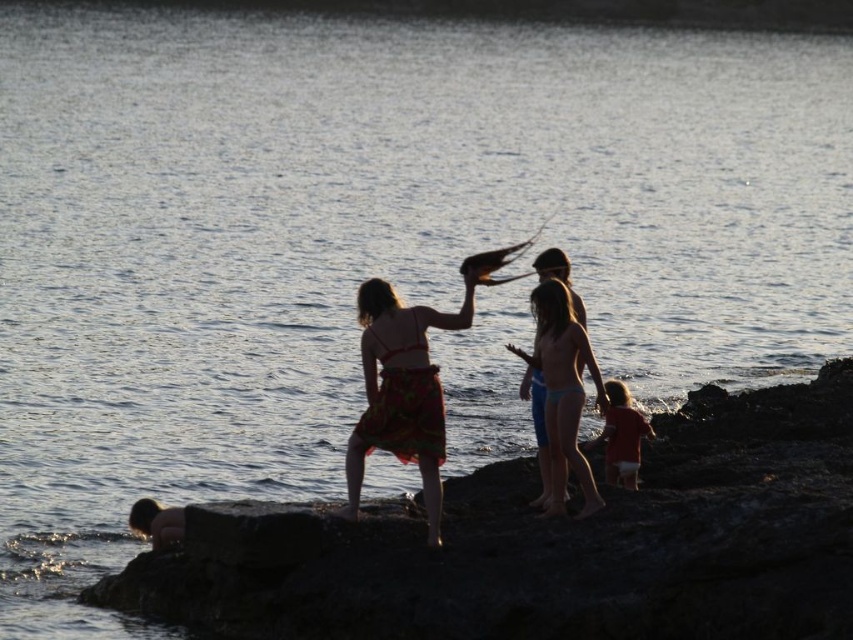
From the picture: You are a photographer trying to capture a wide shot of the lakeside scene. You notice the silhouette floral skirt at center and the red matte shirt at lower right in your frame. Based on their widths, which object should you prioritize keeping in focus to ensure the entire scene remains sharp?

The silhouette floral skirt at center has a lesser width compared to red matte shirt at lower right. Since the silhouette floral skirt at center is narrower, it requires less depth of field, so prioritizing focus on it would help maintain sharpness across the entire scene.

You are a photographer positioned at the lakeside. You want to capture a photo that includes both the matte pink bikini at center and the red matte shirt at lower right. Which object should you focus on first to ensure both are in frame?

The matte pink bikini at center is above the red matte shirt at lower right, so you should focus on the matte pink bikini at center first to ensure both are in frame.